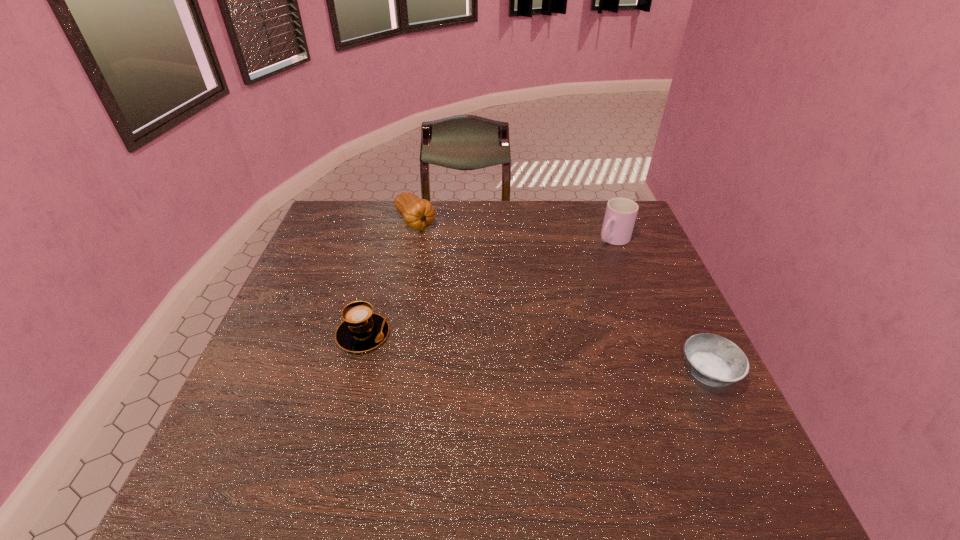
Identify the location of unoccupied area between the ashtray and the cappuccino. This screenshot has height=540, width=960. (536, 353).

This screenshot has width=960, height=540. What are the coordinates of `empty location between the cappuccino and the cup` in the screenshot? It's located at (489, 287).

The width and height of the screenshot is (960, 540). Find the location of `free space between the gourd and the ashtray`. free space between the gourd and the ashtray is located at coordinates (562, 298).

Where is `empty space that is in between the ashtray and the cappuccino`? empty space that is in between the ashtray and the cappuccino is located at coordinates (536, 353).

The height and width of the screenshot is (540, 960). I want to click on free space that is in between the cup and the ashtray, so pyautogui.click(x=660, y=306).

You are a GUI agent. You are given a task and a screenshot of the screen. Output one action in this format:
    pyautogui.click(x=<x>, y=<y>)
    Task: Click on the object that ranks as the closest to the cup
    The width and height of the screenshot is (960, 540).
    Given the screenshot: What is the action you would take?
    pyautogui.click(x=716, y=361)

Choose which object is the third nearest neighbor to the cappuccino. Please provide its 2D coordinates. Your answer should be formatted as a tuple, i.e. [(x, y)], where the tuple contains the x and y coordinates of a point satisfying the conditions above.

[(716, 361)]

At what (x,y) coordinates should I click in order to perform the action: click on vacant space that satisfies the following two spatial constraints: 1. on the front side of the ashtray; 2. on the right side of the gourd. Please return your answer as a coordinate pair (x, y). Looking at the image, I should click on (385, 373).

Where is `blank space that satisfies the following two spatial constraints: 1. on the front side of the ashtray; 2. on the right side of the third tallest object`? This screenshot has height=540, width=960. blank space that satisfies the following two spatial constraints: 1. on the front side of the ashtray; 2. on the right side of the third tallest object is located at coordinates (353, 373).

The height and width of the screenshot is (540, 960). I want to click on free space that satisfies the following two spatial constraints: 1. on the front side of the ashtray; 2. on the left side of the cup, so click(664, 373).